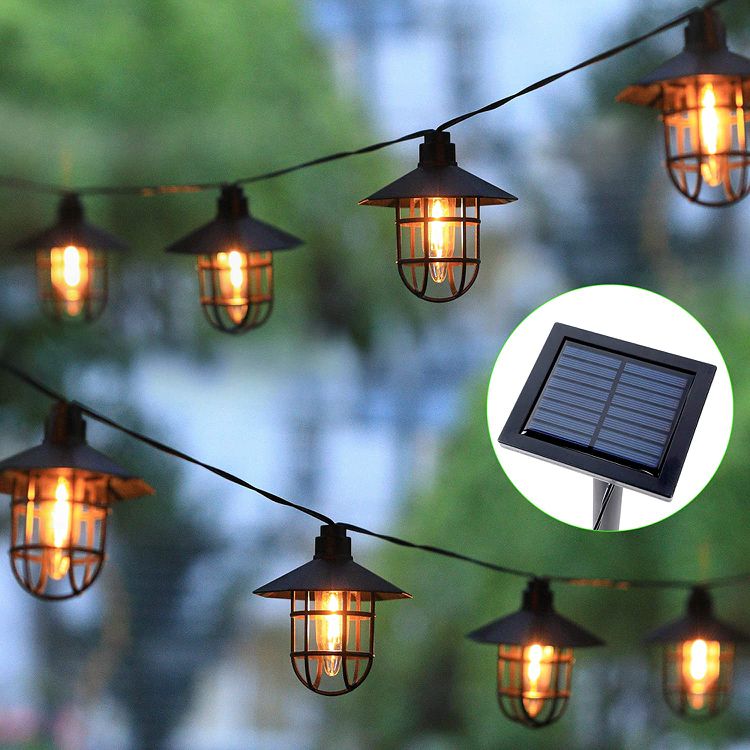
Locate an element on the screen. The image size is (750, 750). reflection of light on black top part of lantern/lamp is located at coordinates (640, 100).